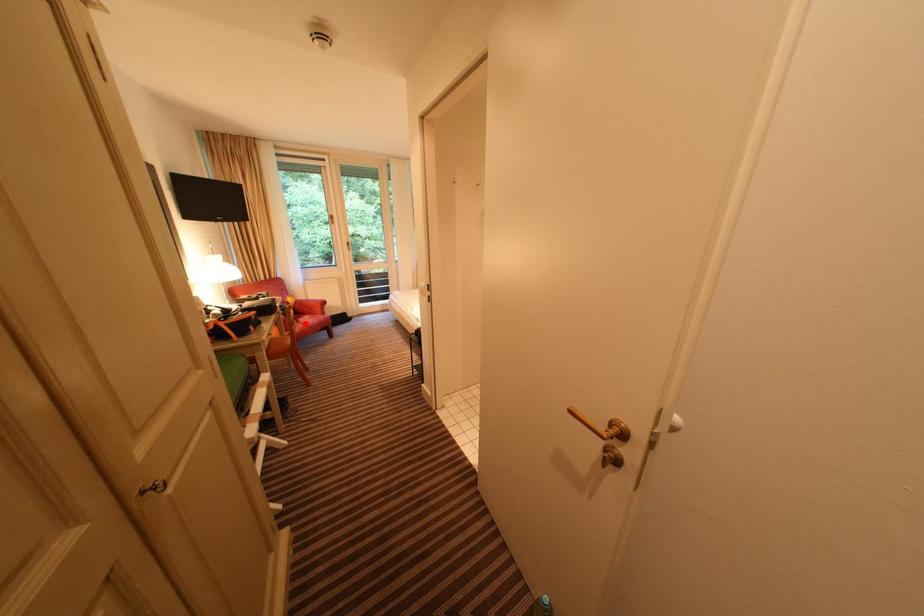
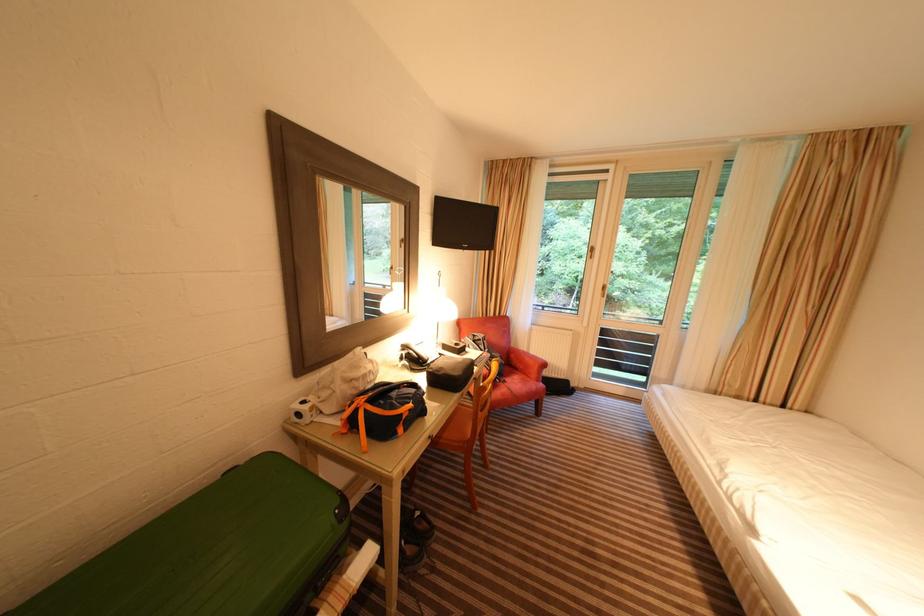
Question: I am providing you with two images of the same scene from different viewpoints. Given a red point in image1, look at the same physical point in image2. Is it:

Choices:
 (A) Closer to the viewpoint
 (B) Farther from the viewpoint

Answer: (B)